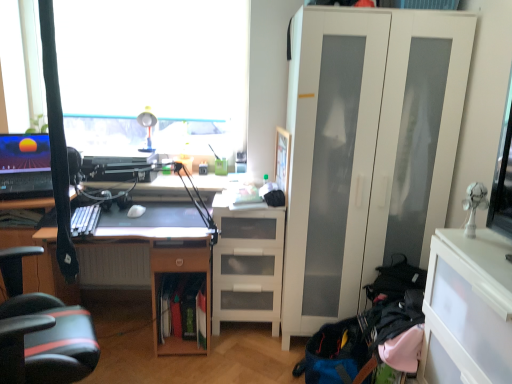
Question: Is wooden desk at center taller than transparent plastic cabinet at lower right?

Choices:
 (A) no
 (B) yes

Answer: (B)

Question: Does wooden desk at center have a lesser height compared to transparent plastic cabinet at lower right?

Choices:
 (A) no
 (B) yes

Answer: (A)

Question: Is wooden desk at center to the right of transparent plastic cabinet at lower right from the viewer's perspective?

Choices:
 (A) no
 (B) yes

Answer: (A)

Question: From the image's perspective, is wooden desk at center below transparent plastic cabinet at lower right?

Choices:
 (A) no
 (B) yes

Answer: (A)

Question: Is wooden desk at center aimed at transparent plastic cabinet at lower right?

Choices:
 (A) no
 (B) yes

Answer: (A)

Question: Does wooden desk at center have a greater width compared to transparent plastic cabinet at lower right?

Choices:
 (A) yes
 (B) no

Answer: (A)

Question: Is wooden desk at center not near matte plastic table lamp at upper center?

Choices:
 (A) no
 (B) yes

Answer: (A)

Question: Is wooden desk at center looking in the opposite direction of matte plastic table lamp at upper center?

Choices:
 (A) no
 (B) yes

Answer: (A)

Question: Is matte plastic table lamp at upper center a part of wooden desk at center?

Choices:
 (A) no
 (B) yes

Answer: (A)

Question: From a real-world perspective, is wooden desk at center over matte plastic table lamp at upper center?

Choices:
 (A) yes
 (B) no

Answer: (B)

Question: Is wooden desk at center to the left of matte plastic table lamp at upper center from the viewer's perspective?

Choices:
 (A) no
 (B) yes

Answer: (B)

Question: Is wooden desk at center outside matte plastic table lamp at upper center?

Choices:
 (A) no
 (B) yes

Answer: (B)

Question: Is the position of transparent plastic cabinet at lower right more distant than that of white matte mouse at center?

Choices:
 (A) no
 (B) yes

Answer: (A)